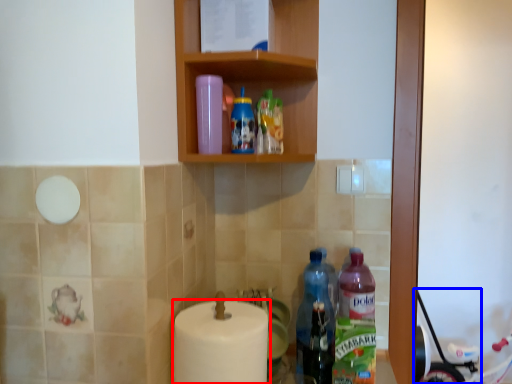
Question: Among these objects, which one is farthest to the camera, toilet paper (highlighted by a red box) or baby carriage (highlighted by a blue box)?

Choices:
 (A) toilet paper
 (B) baby carriage

Answer: (B)